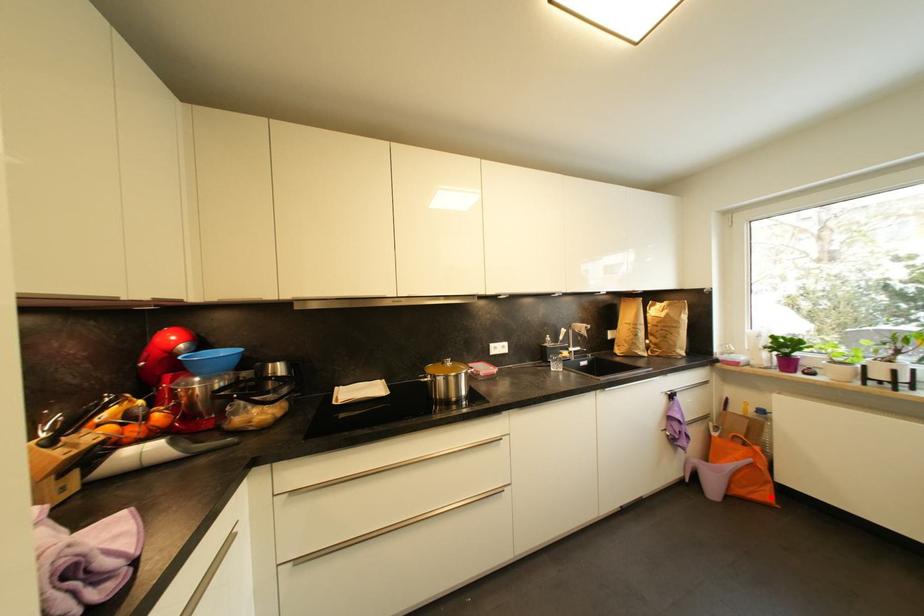
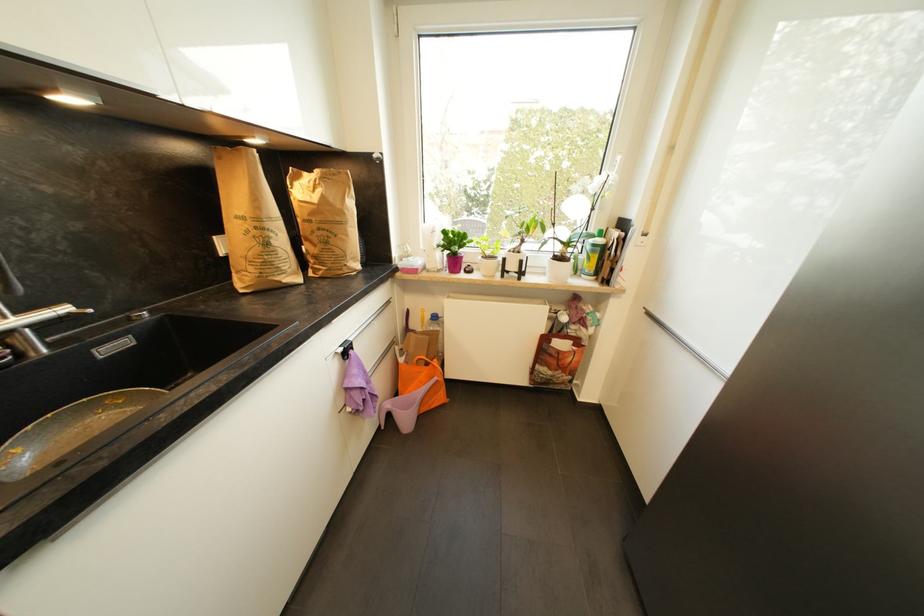
Locate, in the second image, the point that corresponds to the highlighted location in the first image.

(445, 399)